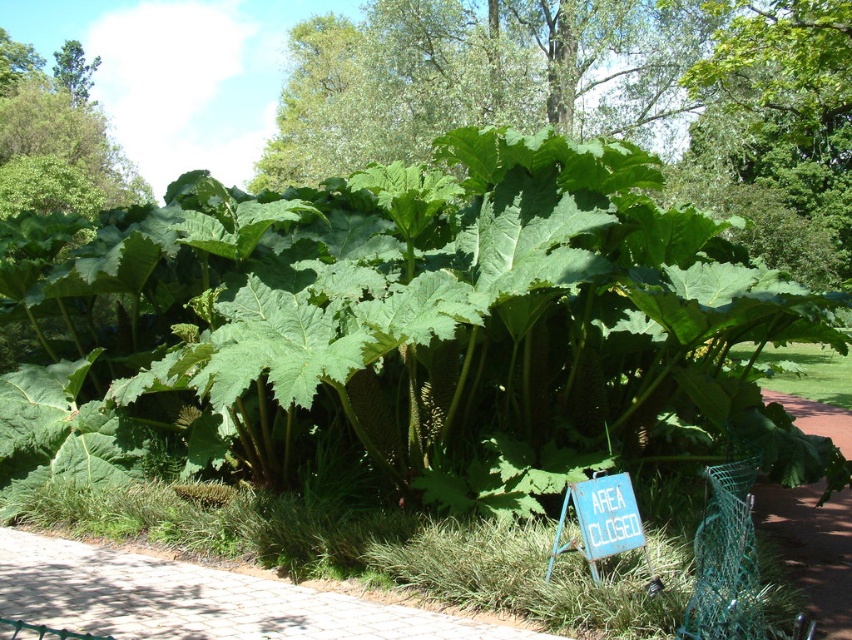
You are standing in the lush green area with the Gunnera plants. There is a point marked at coordinates (x=597, y=99). Which object from the scene does this point belong to?

The point at coordinates (x=597, y=99) is on the green leafy plant at center.

You are a hiker who wants to take a photo of the green leafy plant at center and the cobblestone path at lower left. Which object should you focus on first if you want to capture both in a single frame without moving the camera?

The green leafy plant at center is bigger than the cobblestone path at lower left, so you should focus on the green leafy plant at center first to ensure it fills the frame appropriately while still including the smaller cobblestone path at lower left in the background.

In the scene shown: You are a hiker who wants to take a shortcut through the area. The cobblestone path at lower left is the only path available. However, you notice the green leafy plant at center. Is the path accessible without going around the plant?

The green leafy plant at center is located above the cobblestone path at lower left, so the path is accessible without needing to go around the plant since the plant is positioned above it.